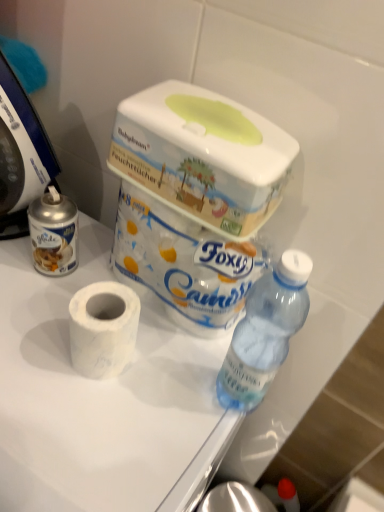
Question: In the image, is blue plastic food processor at left positioned in front of or behind white matte toilet paper at center, which is the 1th toilet paper from bottom to top?

Choices:
 (A) front
 (B) behind

Answer: (A)

Question: Is point (23, 178) positioned closer to the camera than point (125, 339)?

Choices:
 (A) farther
 (B) closer

Answer: (A)

Question: Which of these objects is positioned closest to the white matte toilet paper at center?

Choices:
 (A) white matte toilet paper at center, which is the 1th toilet paper from bottom to top
 (B) white marble toilet paper at center, which is the 1th toilet paper in top-to-bottom order
 (C) blue plastic food processor at left
 (D) white plastic box at upper center

Answer: (A)

Question: Which of these objects is positioned farthest from the white matte toilet paper at center?

Choices:
 (A) white matte toilet paper at center, which is the 1th toilet paper from bottom to top
 (B) white plastic box at upper center
 (C) white marble toilet paper at center, arranged as the second toilet paper when ordered from the bottom
 (D) blue plastic food processor at left

Answer: (D)